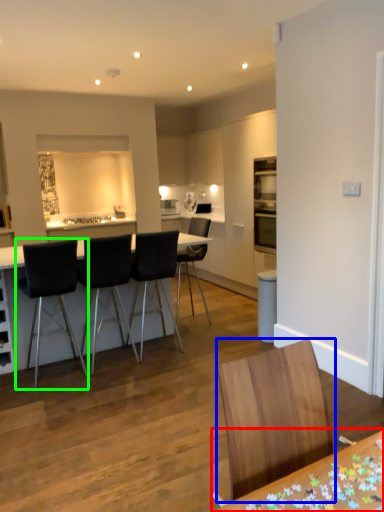
Question: Estimate the real-world distances between objects in this image. Which object is farther from table (highlighted by a red box), chair (highlighted by a blue box) or chair (highlighted by a green box)?

Choices:
 (A) chair
 (B) chair

Answer: (B)